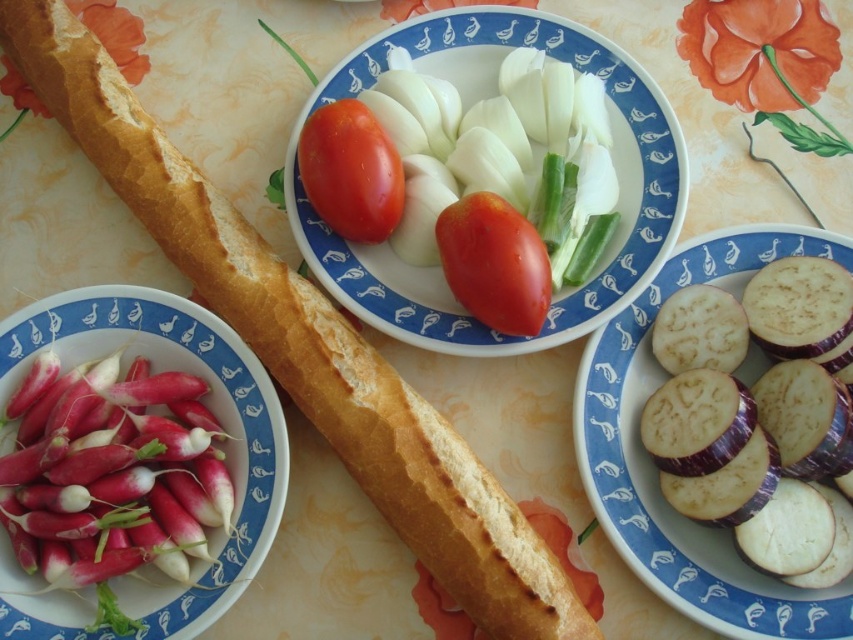
Between golden crusty baguette at center and sliced purple eggplant at center, which one appears on the right side from the viewer's perspective?

Positioned to the right is sliced purple eggplant at center.

Is point (479, 582) more distant than point (701, 608)?

No.

Between point (120, 188) and point (631, 324), which one is positioned in front?

Positioned in front is point (120, 188).

I want to click on golden crusty baguette at center, so click(305, 344).

Measure the distance between red radish at left and shiny red tomato at center.

41.36 centimeters

Can you confirm if red radish at left is positioned below shiny red tomato at center?

Yes.

Does point (157, 572) come in front of point (508, 211)?

Yes, it is.

Identify the location of red radish at left. This screenshot has height=640, width=853. (207, 404).

Between red radish at left and glossy red tomato at center, which one is positioned lower?

red radish at left is below.

Which is above, red radish at left or glossy red tomato at center?

Positioned higher is glossy red tomato at center.

Between point (149, 298) and point (399, 160), which one is positioned in front?

Point (149, 298) is in front.

Identify the location of red radish at left. Image resolution: width=853 pixels, height=640 pixels. (207, 404).